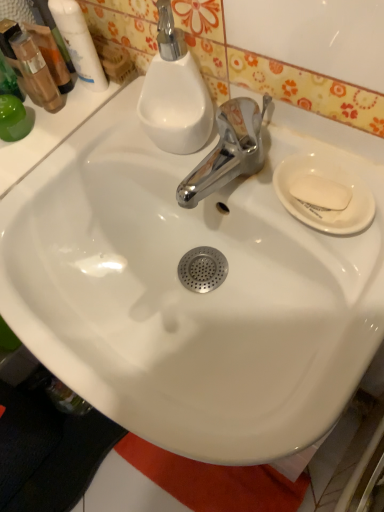
What are the coordinates of `empty space that is in between white matte soap at right and translucent plastic mouthwash at upper left, the 1th mouthwash in the left-to-right sequence` in the screenshot? It's located at (152, 141).